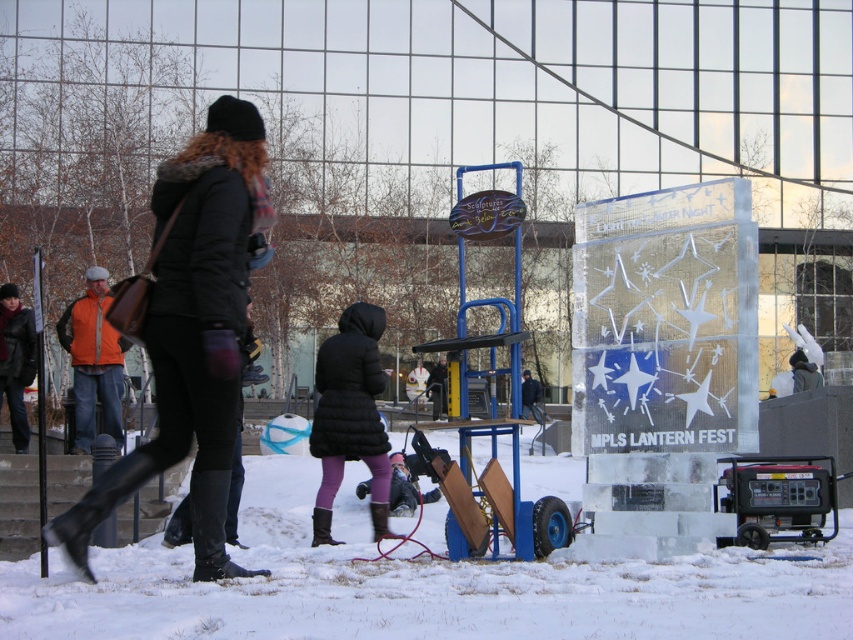
Question: Does black leather jacket at upper left appear on the right side of leather jacket at left?

Choices:
 (A) yes
 (B) no

Answer: (A)

Question: Can you confirm if black puffy coat at center is positioned above leather jacket at left?

Choices:
 (A) yes
 (B) no

Answer: (B)

Question: Which of these objects is positioned closest to the orange fleece vest at left?

Choices:
 (A) black leather jacket at upper left
 (B) black puffy coat at center
 (C) dark blue jacket at center

Answer: (B)

Question: Is the position of black puffy coat at center more distant than that of orange fleece vest at left?

Choices:
 (A) no
 (B) yes

Answer: (A)

Question: Estimate the real-world distances between objects in this image. Which object is farther from the orange fleece vest at left?

Choices:
 (A) dark blue jacket at center
 (B) black puffy coat at center
 (C) leather jacket at left

Answer: (A)

Question: Which object is the closest to the dark blue jacket at center?

Choices:
 (A) leather jacket at left
 (B) black leather jacket at upper left

Answer: (A)